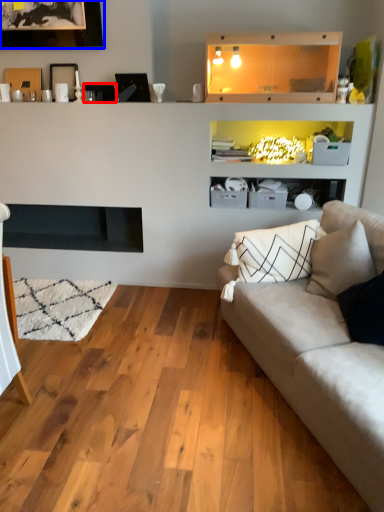
Question: Among these objects, which one is farthest to the camera, picture frame (highlighted by a red box) or picture frame (highlighted by a blue box)?

Choices:
 (A) picture frame
 (B) picture frame

Answer: (A)